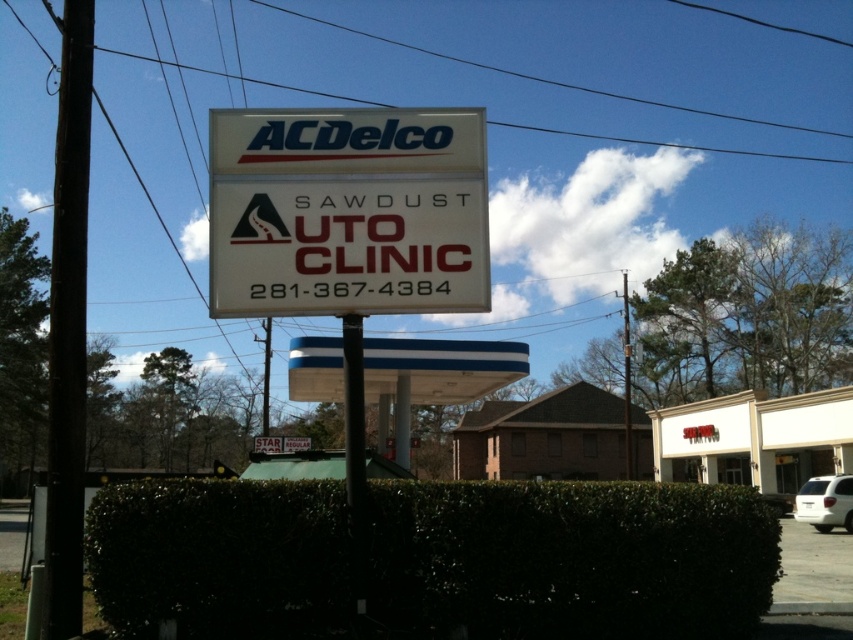
Is point (447, 298) closer to viewer compared to point (457, 424)?

Yes, point (447, 298) is in front of point (457, 424).

Between white plastic sign at center and brown brick motel at center, which one is positioned higher?

Positioned higher is white plastic sign at center.

Is point (252, 314) farther from camera compared to point (552, 422)?

That is False.

At what (x,y) coordinates should I click in order to perform the action: click on white plastic sign at center. Please return your answer as a coordinate pair (x, y). The width and height of the screenshot is (853, 640). Looking at the image, I should click on (347, 211).

Does green leafy hedge at center appear on the right side of brown brick motel at center?

In fact, green leafy hedge at center is to the left of brown brick motel at center.

Which is above, green leafy hedge at center or brown brick motel at center?

Positioned higher is green leafy hedge at center.

Locate an element on the screen. green leafy hedge at center is located at coordinates pos(570,560).

Is green leafy hedge at center taller than white plastic sign at center?

Yes, green leafy hedge at center is taller than white plastic sign at center.

Locate an element on the screen. green leafy hedge at center is located at coordinates (570, 560).